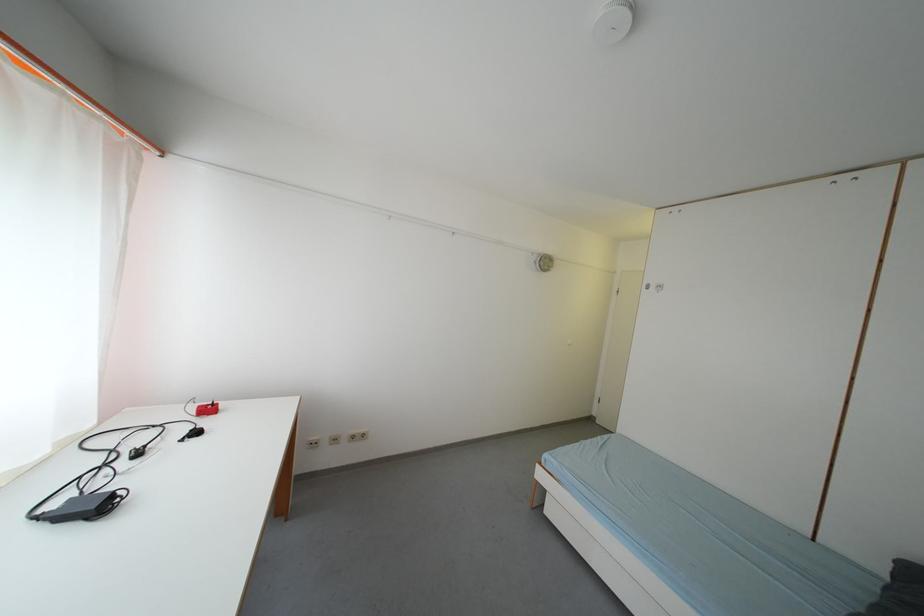
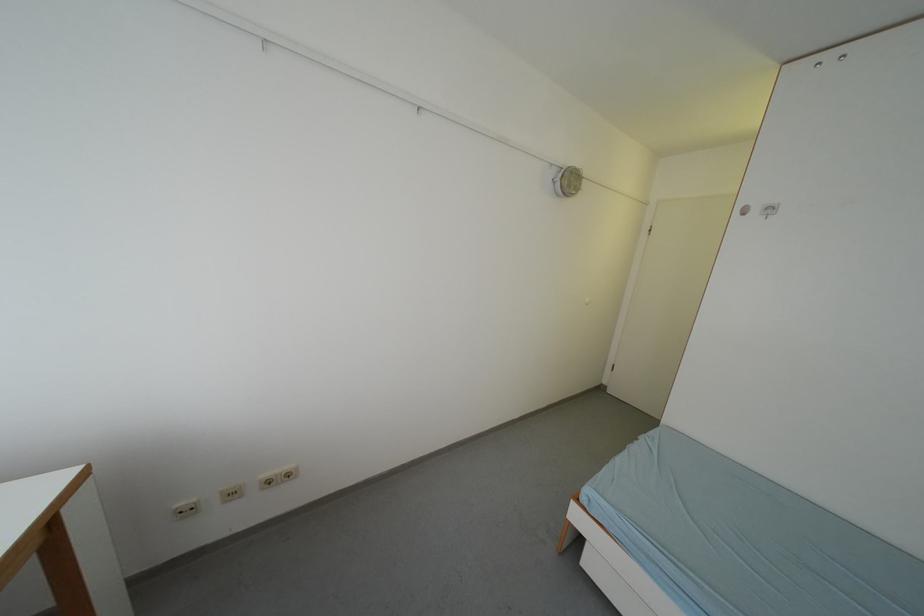
Where in the second image is the point corresponding to point 554,265 from the first image?

(578, 185)